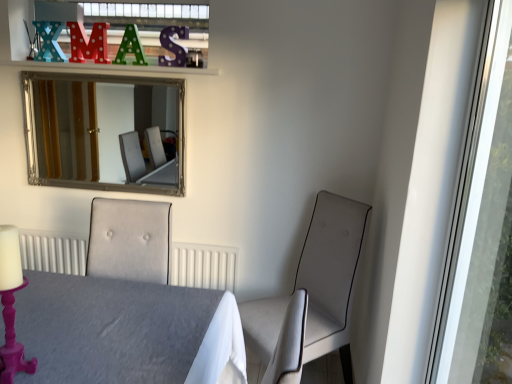
Where is `vacant region above silver/glass mirror at upper left (from a real-world perspective)`? vacant region above silver/glass mirror at upper left (from a real-world perspective) is located at coordinates (109, 72).